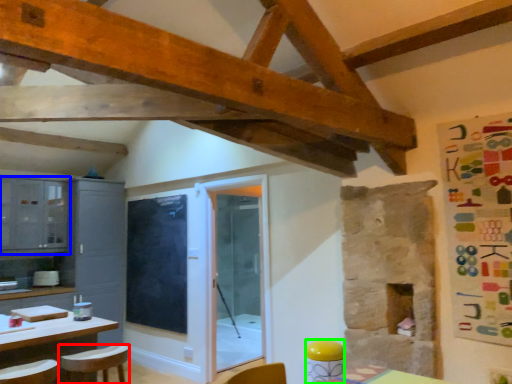
Question: Which object is positioned closest to chair (highlighted by a red box)? Select from cabinetry (highlighted by a blue box) and bar stool (highlighted by a green box).

Choices:
 (A) cabinetry
 (B) bar stool

Answer: (B)